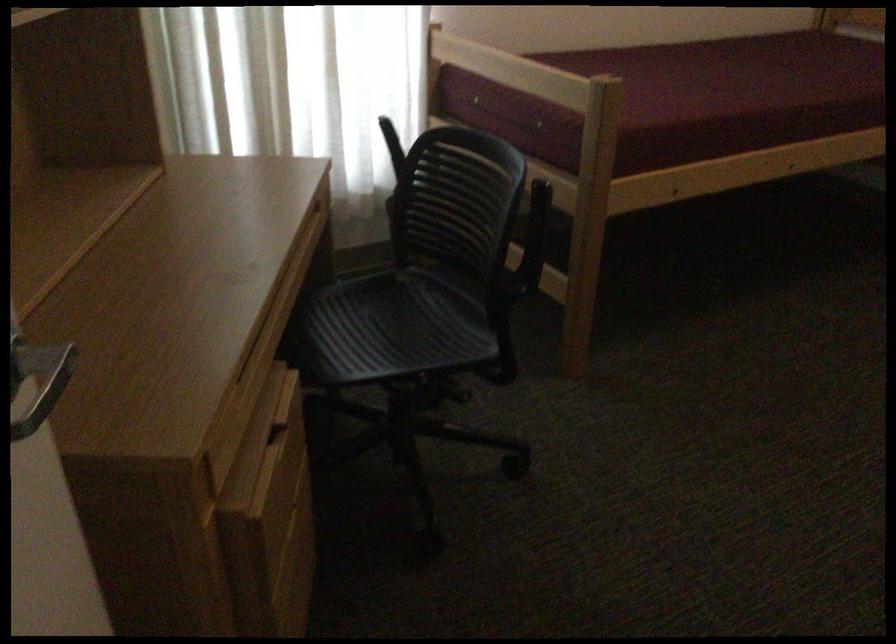
Find where to sit the chair sitting surface. Please return your answer as a coordinate pair (x, y).

(365, 307)